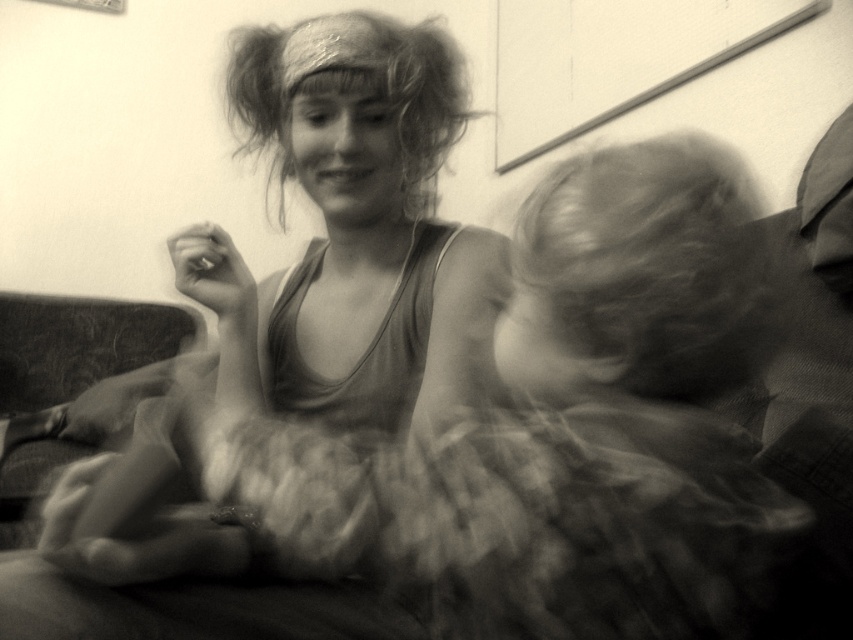
Who is positioned more to the left, matte fabric dress at center or curly hair at upper center?

From the viewer's perspective, matte fabric dress at center appears more on the left side.

Identify the location of matte fabric dress at center. Image resolution: width=853 pixels, height=640 pixels. (347, 230).

Who is more forward, (308, 284) or (697, 234)?

Point (697, 234) is more forward.

Can you confirm if matte fabric dress at center is wider than blonde fuzzy hair at right?

Yes.

Identify the location of matte fabric dress at center. Image resolution: width=853 pixels, height=640 pixels. (347, 230).

Who is more distant from viewer, (708, 388) or (424, 246)?

A: The point (424, 246) is behind.

Between point (572, 243) and point (228, 244), which one is positioned in front?

Point (572, 243) is in front.

Locate an element on the screen. smooth fabric dress at center is located at coordinates (563, 428).